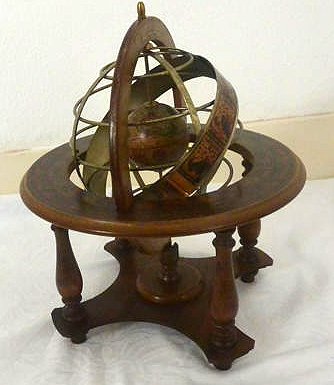
Find the location of a particular element. The width and height of the screenshot is (334, 385). table legs is located at coordinates (226, 296), (70, 285), (248, 229).